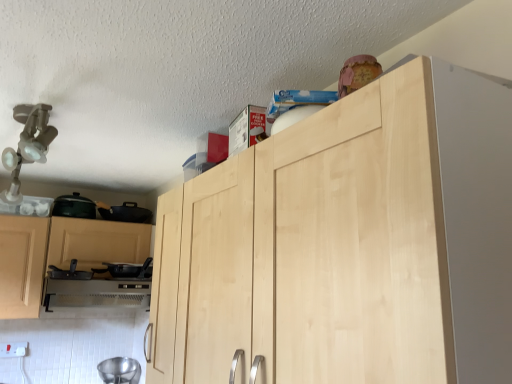
Question: In terms of width, does black matte pan at lower left, the third appliance positioned from the bottom, look wider or thinner when compared to black matte pan at lower left, the third appliance from the top?

Choices:
 (A) thin
 (B) wide

Answer: (B)

Question: In terms of size, does black matte pan at lower left, the third appliance positioned from the bottom, appear bigger or smaller than black matte pan at lower left, the second appliance from the bottom?

Choices:
 (A) big
 (B) small

Answer: (B)

Question: Estimate the real-world distances between objects in this image. Which object is closer to the satin silver oven at lower left?

Choices:
 (A) matte black pot at left, which is counted as the fourth appliance, starting from the bottom
 (B) black matte pan at lower left, positioned as the 2th appliance in top-to-bottom order
 (C) white plastic electric outlet at lower left
 (D) natural wood cabinet at upper center
 (E) black matte pan at lower left, the second appliance from the bottom

Answer: (E)

Question: Considering the real-world distances, which object is closest to the natural wood cabinet at upper center?

Choices:
 (A) matte black pot at left, which is counted as the fourth appliance, starting from the bottom
 (B) black matte pan at lower left, the second appliance from the bottom
 (C) black matte pan at lower left, positioned as the 2th appliance in top-to-bottom order
 (D) satin silver oven at lower left
 (E) white plastic electric outlet at lower left

Answer: (B)